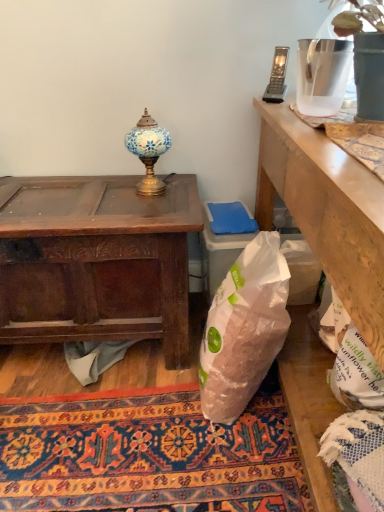
Where is `free space to the left of translucent plastic bag at center`? free space to the left of translucent plastic bag at center is located at coordinates (159, 396).